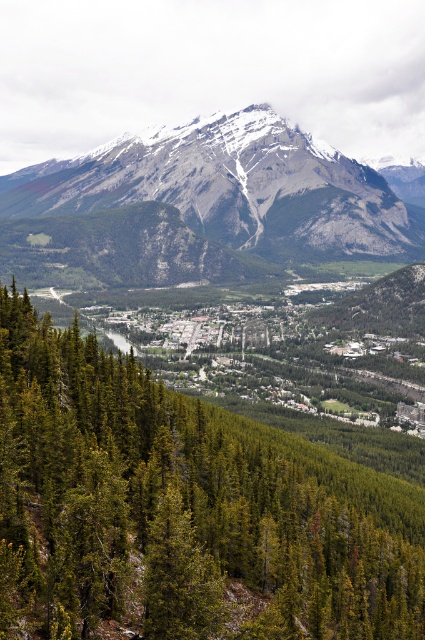
Can you confirm if green matte tree at center is bigger than snowy granite mountain range at upper center?

No.

Who is positioned more to the right, green matte tree at center or snowy granite mountain range at upper center?

green matte tree at center

What do you see at coordinates (181, 509) in the screenshot? The width and height of the screenshot is (425, 640). I see `green matte tree at center` at bounding box center [181, 509].

You are a GUI agent. You are given a task and a screenshot of the screen. Output one action in this format:
    pyautogui.click(x=<x>, y=<y>)
    Task: Click on the green matte tree at center
    This screenshot has width=425, height=640.
    Given the screenshot: What is the action you would take?
    pyautogui.click(x=181, y=509)